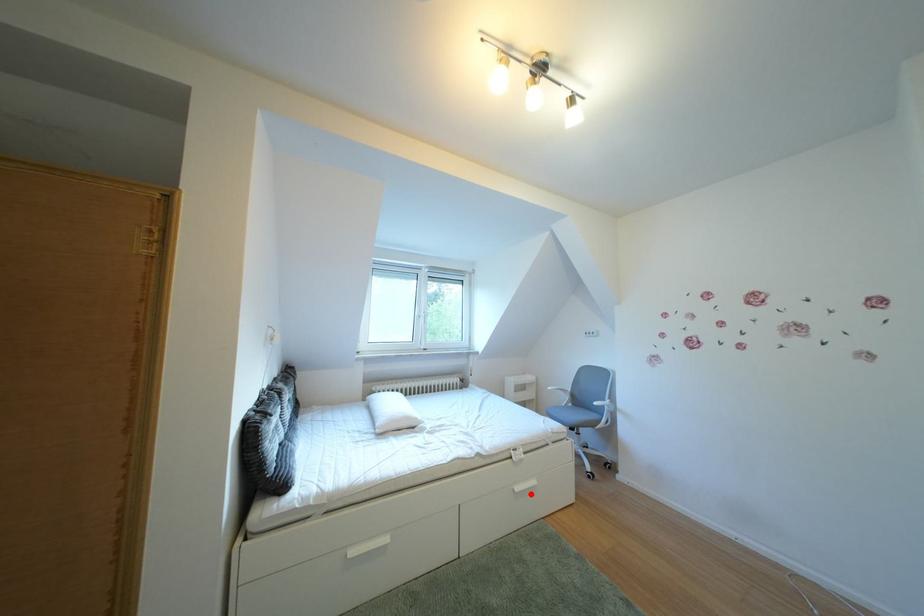
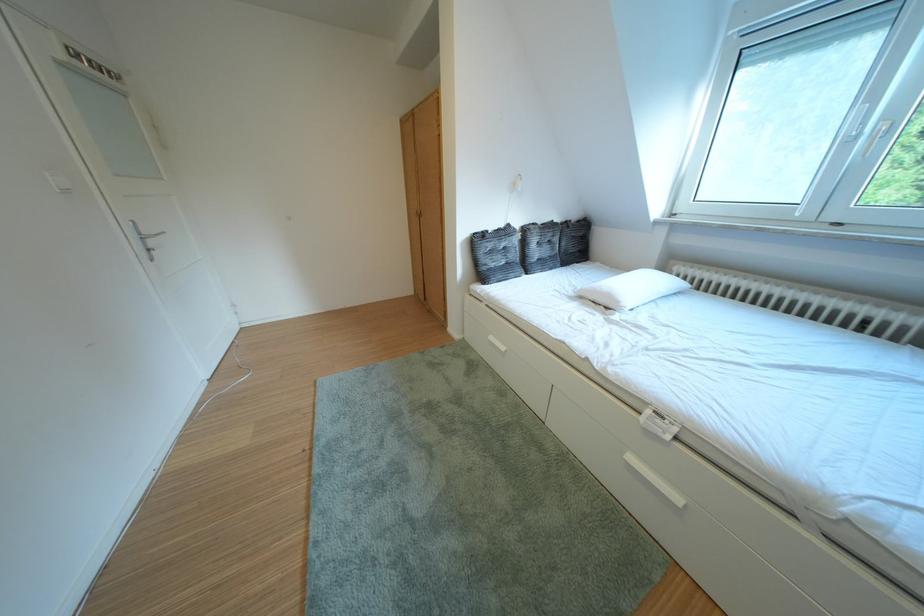
Locate, in the second image, the point that corresponds to the highlighted location in the first image.

(646, 464)